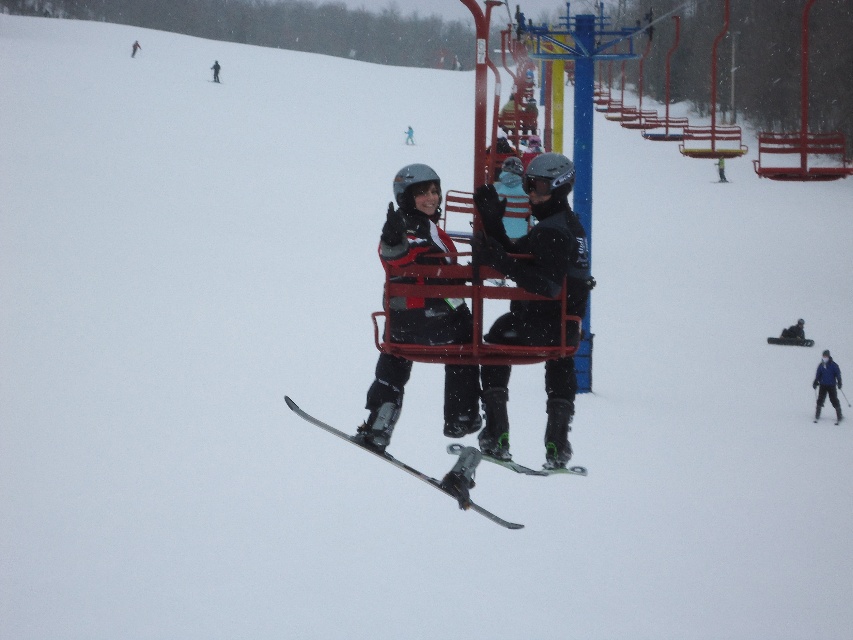
How much distance is there between blue fabric jacket at lower right and matte black skier at center?

blue fabric jacket at lower right and matte black skier at center are 45.16 meters apart.

Which is in front, point (830, 392) or point (404, 141)?

Point (830, 392)

The width and height of the screenshot is (853, 640). Describe the element at coordinates (827, 385) in the screenshot. I see `blue fabric jacket at lower right` at that location.

The image size is (853, 640). What are the coordinates of `blue fabric jacket at lower right` in the screenshot? It's located at (827, 385).

Can you confirm if matte black jacket at center is positioned to the right of green fabric jacket at center?

In fact, matte black jacket at center is to the left of green fabric jacket at center.

Consider the image. Which of these two, matte black jacket at center or green fabric jacket at center, stands taller?

matte black jacket at center

Locate an element on the screen. This screenshot has width=853, height=640. matte black jacket at center is located at coordinates (415, 220).

Identify the location of matte black jacket at center. (415, 220).

Who is shorter, matte black jacket at center or blue fabric jacket at lower right?

Standing shorter between the two is blue fabric jacket at lower right.

Is the position of matte black jacket at center less distant than that of blue fabric jacket at lower right?

Yes, it is.

Where is `matte black jacket at center`? Image resolution: width=853 pixels, height=640 pixels. matte black jacket at center is located at coordinates (x=415, y=220).